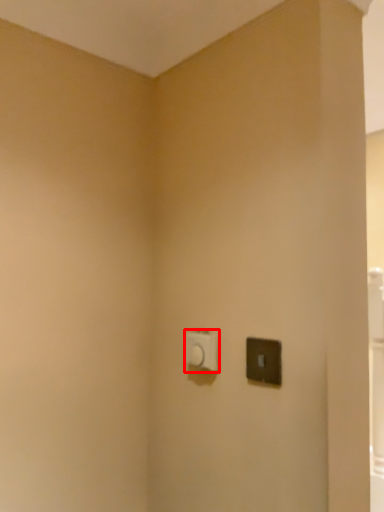
Question: From the image's perspective, what is the correct spatial positioning of light switch (annotated by the red box) in reference to light switch?

Choices:
 (A) below
 (B) above

Answer: (A)